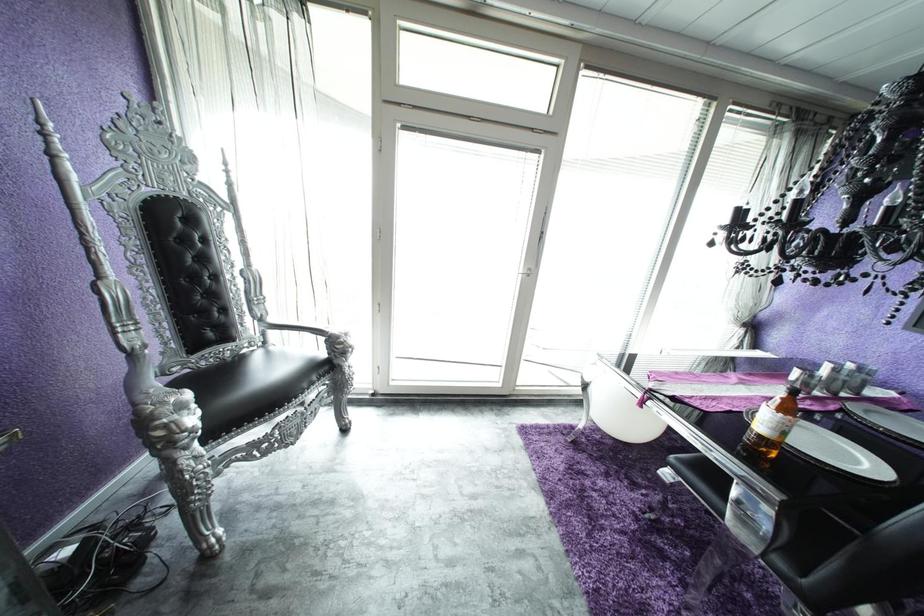
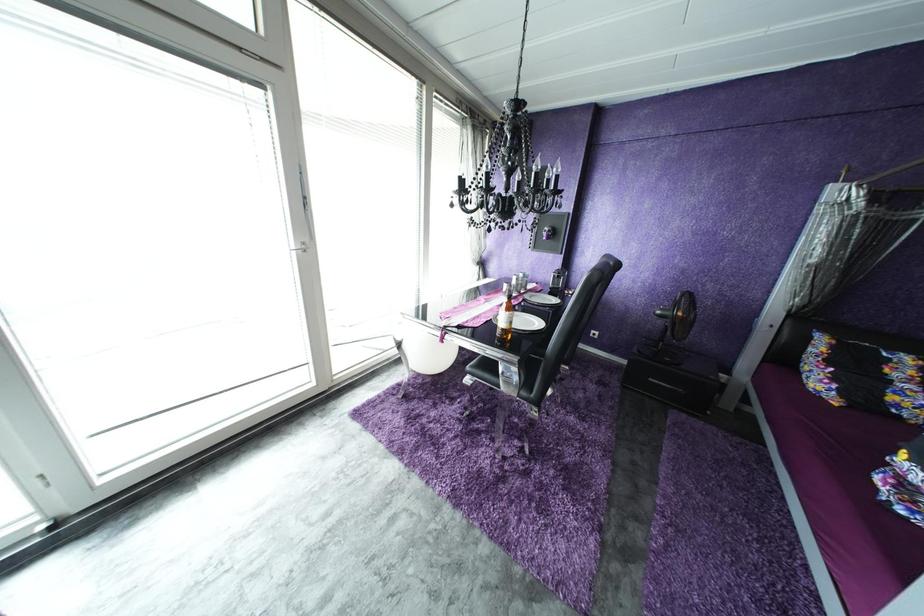
Question: Based on the continuous images, in which direction is the camera rotating? Reply with the corresponding letter.

Choices:
 (A) Left
 (B) Right
 (C) Up
 (D) Down

Answer: (B)